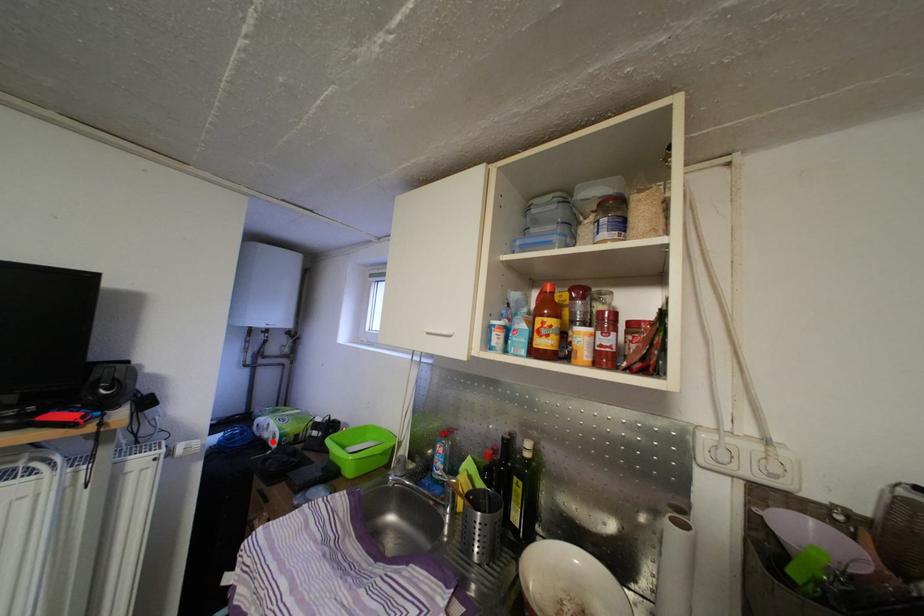
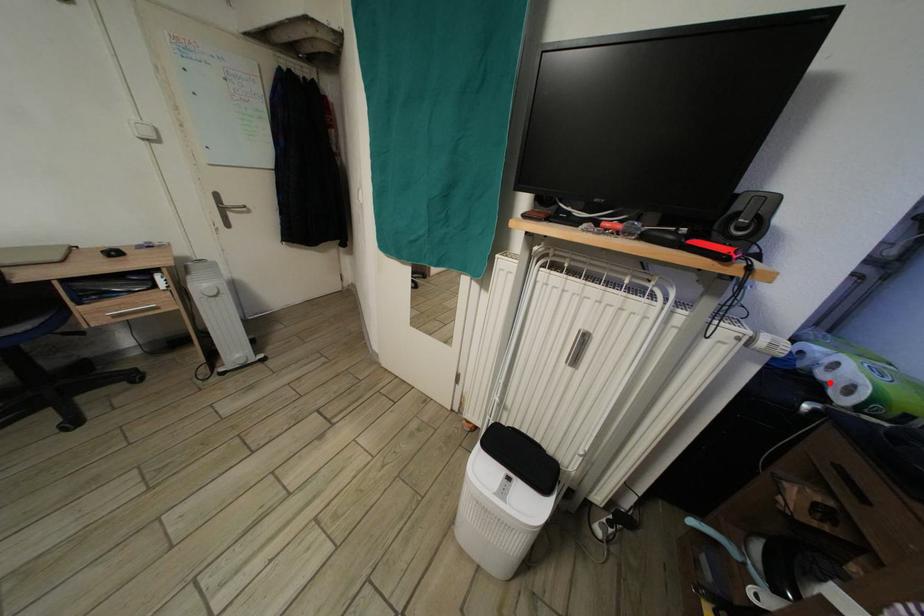
I am providing you with two images of the same scene from different viewpoints. A red point is marked on the first image and another point is marked on the second image. Is the red point in image1 aligned with the point shown in image2?

Yes